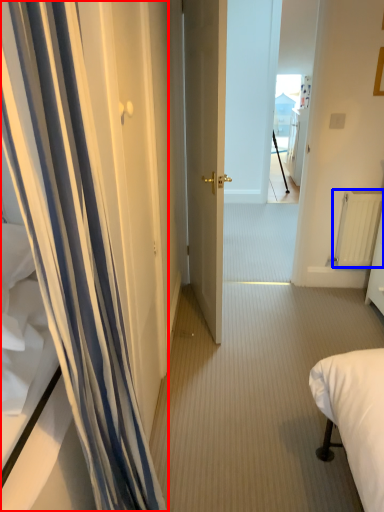
Question: Which point is further to the camera, curtain (highlighted by a red box) or radiator (highlighted by a blue box)?

Choices:
 (A) curtain
 (B) radiator

Answer: (B)